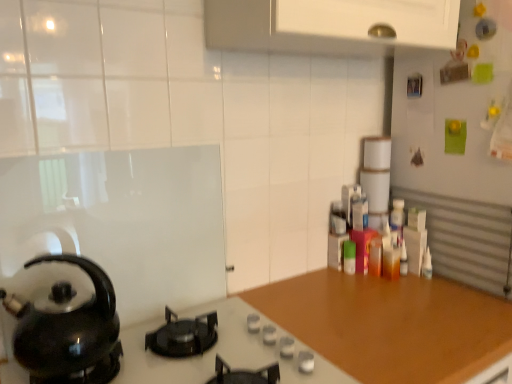
Where is `vacant point above wooden at center (from a real-world perspective)`? Image resolution: width=512 pixels, height=384 pixels. vacant point above wooden at center (from a real-world perspective) is located at coordinates (391, 309).